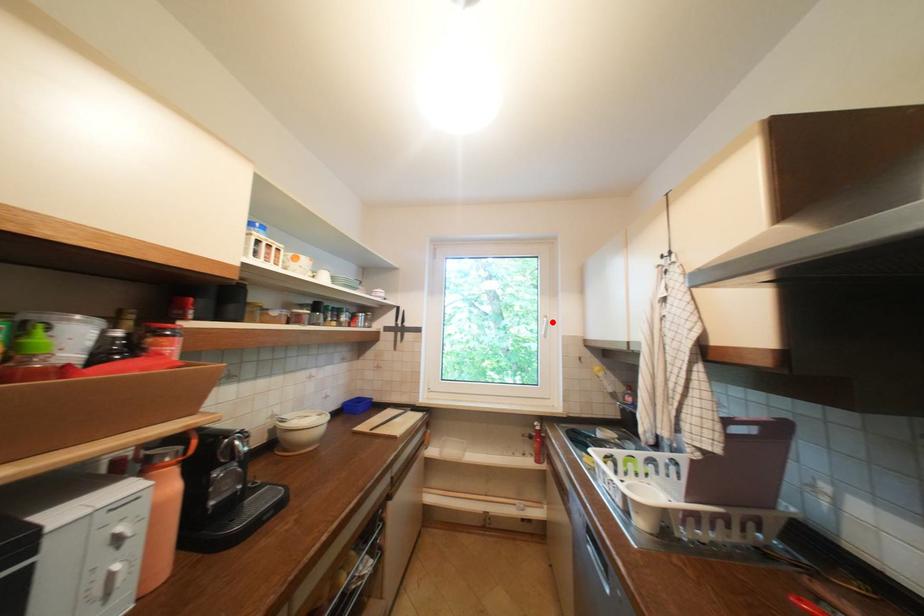
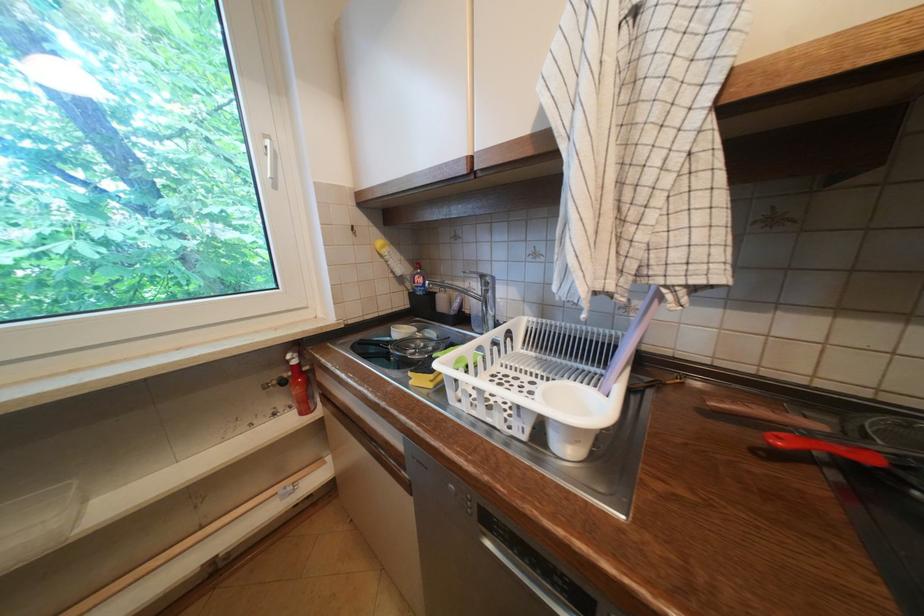
Question: I am providing you with two images of the same scene from different viewpoints. Image1 has a red point marked. In image2, the corresponding 3D location appears at what relative position? Reply with the corresponding letter.

Choices:
 (A) Closer
 (B) Farther

Answer: (A)